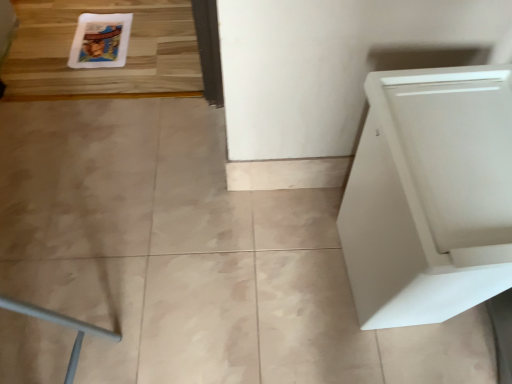
What do you see at coordinates (100, 40) in the screenshot? This screenshot has width=512, height=384. I see `white glossy comic book at upper left` at bounding box center [100, 40].

Identify the location of white glossy comic book at upper left. This screenshot has height=384, width=512. (100, 40).

Where is `white matte cabinet at right`? Image resolution: width=512 pixels, height=384 pixels. white matte cabinet at right is located at coordinates (430, 195).

This screenshot has height=384, width=512. What do you see at coordinates (430, 195) in the screenshot?
I see `white matte cabinet at right` at bounding box center [430, 195].

I want to click on white glossy comic book at upper left, so click(x=100, y=40).

Does white glossy comic book at upper left appear on the right side of white matte cabinet at right?

No.

Is the position of white glossy comic book at upper left less distant than that of white matte cabinet at right?

No, the depth of white glossy comic book at upper left is greater than that of white matte cabinet at right.

Is point (97, 47) closer to viewer compared to point (482, 185)?

No, it is not.

From the image's perspective, which is below, white glossy comic book at upper left or white matte cabinet at right?

From the image's view, white matte cabinet at right is below.

Based on the photo, from a real-world perspective, is white glossy comic book at upper left above or below white matte cabinet at right?

In terms of real-world spatial position, white glossy comic book at upper left is below white matte cabinet at right.

Considering the relative sizes of white glossy comic book at upper left and white matte cabinet at right in the image provided, is white glossy comic book at upper left thinner than white matte cabinet at right?

No, white glossy comic book at upper left is not thinner than white matte cabinet at right.

Does white glossy comic book at upper left have a greater height compared to white matte cabinet at right?

In fact, white glossy comic book at upper left may be shorter than white matte cabinet at right.

Considering the sizes of objects white glossy comic book at upper left and white matte cabinet at right in the image provided, who is smaller, white glossy comic book at upper left or white matte cabinet at right?

With smaller size is white glossy comic book at upper left.

Is white glossy comic book at upper left completely or partially outside of white matte cabinet at right?

Yes.

Does white glossy comic book at upper left touch white matte cabinet at right?

They are not placed beside each other.

Is white glossy comic book at upper left turned away from white matte cabinet at right?

No, white matte cabinet at right is not at the back of white glossy comic book at upper left.

How different are the orientations of white glossy comic book at upper left and white matte cabinet at right in degrees?

The angle between the facing direction of white glossy comic book at upper left and the facing direction of white matte cabinet at right is 91.5 degrees.

How far apart are white glossy comic book at upper left and white matte cabinet at right?

white glossy comic book at upper left is 3.94 feet away from white matte cabinet at right.

Where is `home appliance below the white glossy comic book at upper left (from the image's perspective)`? The width and height of the screenshot is (512, 384). home appliance below the white glossy comic book at upper left (from the image's perspective) is located at coordinates (430, 195).

Which object is positioned more to the left, white matte cabinet at right or white glossy comic book at upper left?

white glossy comic book at upper left.

Which object is more forward, white matte cabinet at right or white glossy comic book at upper left?

white matte cabinet at right is in front.

Considering the positions of points (424, 142) and (92, 59), is point (424, 142) farther from camera compared to point (92, 59)?

No, (424, 142) is in front of (92, 59).

From the image's perspective, does white matte cabinet at right appear higher than white glossy comic book at upper left?

Incorrect, from the image's perspective, white matte cabinet at right is lower than white glossy comic book at upper left.

From a real-world perspective, is white matte cabinet at right physically located above or below white glossy comic book at upper left?

From a real-world perspective, white matte cabinet at right is physically above white glossy comic book at upper left.

Does white matte cabinet at right have a lesser width compared to white glossy comic book at upper left?

Yes.

Is white matte cabinet at right taller or shorter than white glossy comic book at upper left?

white matte cabinet at right is taller than white glossy comic book at upper left.

Who is smaller, white matte cabinet at right or white glossy comic book at upper left?

Smaller between the two is white glossy comic book at upper left.

Is white matte cabinet at right not within white glossy comic book at upper left?

That's correct, white matte cabinet at right is outside of white glossy comic book at upper left.

Does white matte cabinet at right touch white glossy comic book at upper left?

No.

Is white matte cabinet at right oriented towards white glossy comic book at upper left?

No.

Can you tell me how much white matte cabinet at right and white glossy comic book at upper left differ in facing direction?

The facing directions of white matte cabinet at right and white glossy comic book at upper left are 91.5 degrees apart.

You are a GUI agent. You are given a task and a screenshot of the screen. Output one action in this format:
    pyautogui.click(x=<x>, y=<y>)
    Task: Click on the comic book above the white matte cabinet at right (from the image's perspective)
    
    Given the screenshot: What is the action you would take?
    pyautogui.click(x=100, y=40)

Where is `home appliance in front of the white glossy comic book at upper left`? The height and width of the screenshot is (384, 512). home appliance in front of the white glossy comic book at upper left is located at coordinates (430, 195).

Find the location of a particular element. home appliance positioned vertically above the white glossy comic book at upper left (from a real-world perspective) is located at coordinates (430, 195).